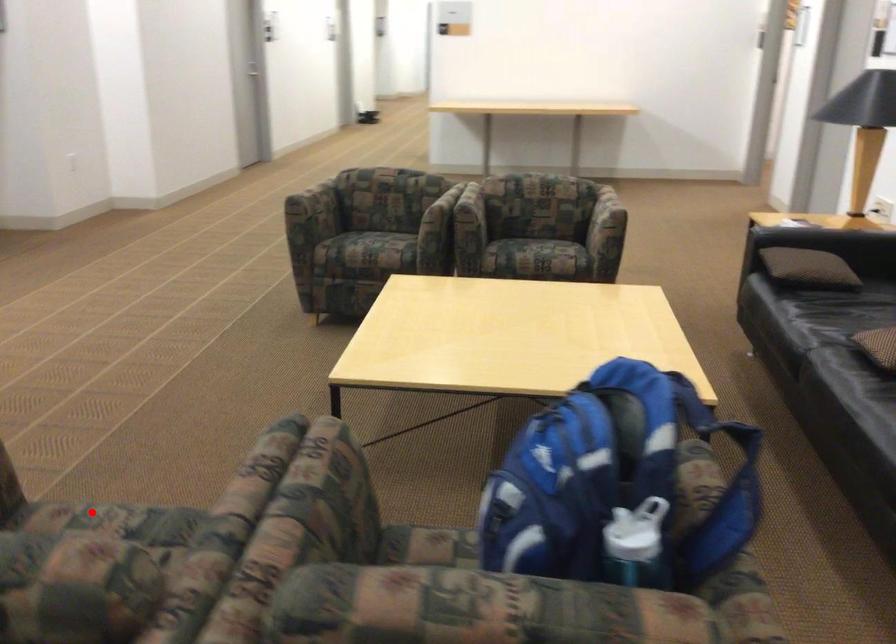
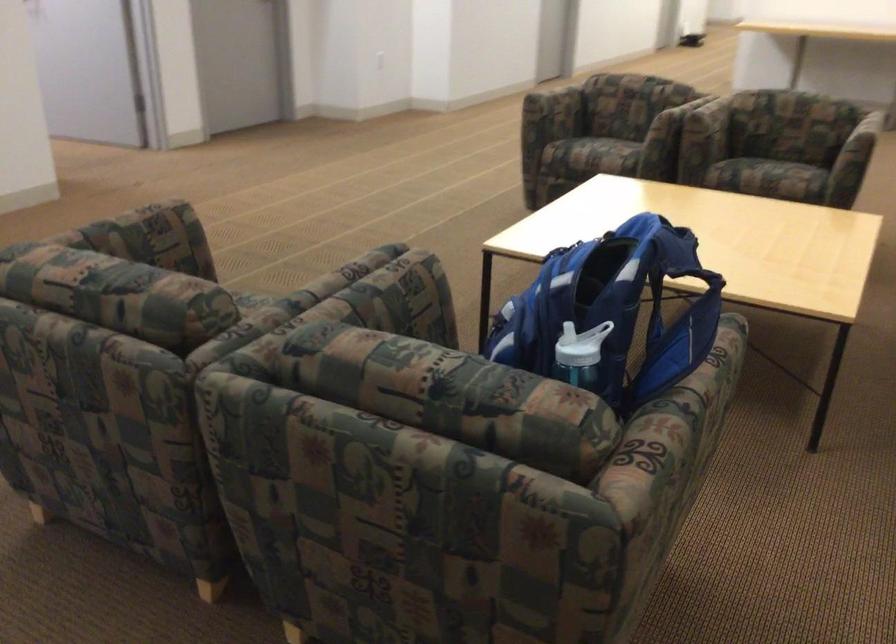
Question: A red point is marked in image1. In image2, is the corresponding 3D point closer to the camera or farther? Reply with the corresponding letter.

Choices:
 (A) The corresponding 3D point is closer.
 (B) The corresponding 3D point is farther.

Answer: (B)